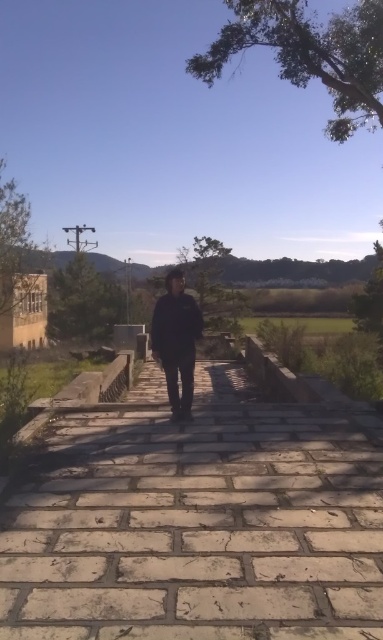
Does light beige stone pavement at center appear on the right side of black matte jacket at center?

Indeed, light beige stone pavement at center is positioned on the right side of black matte jacket at center.

Consider the image. Is light beige stone pavement at center closer to camera compared to black matte jacket at center?

Yes, light beige stone pavement at center is closer to the viewer.

What do you see at coordinates (199, 522) in the screenshot? I see `light beige stone pavement at center` at bounding box center [199, 522].

At what (x,y) coordinates should I click in order to perform the action: click on light beige stone pavement at center. Please return your answer as a coordinate pair (x, y). Looking at the image, I should click on (199, 522).